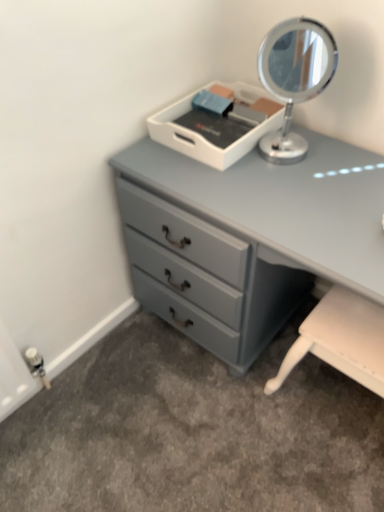
The image size is (384, 512). Identify the location of vacant area to the left of matte gray dresser at center. (123, 406).